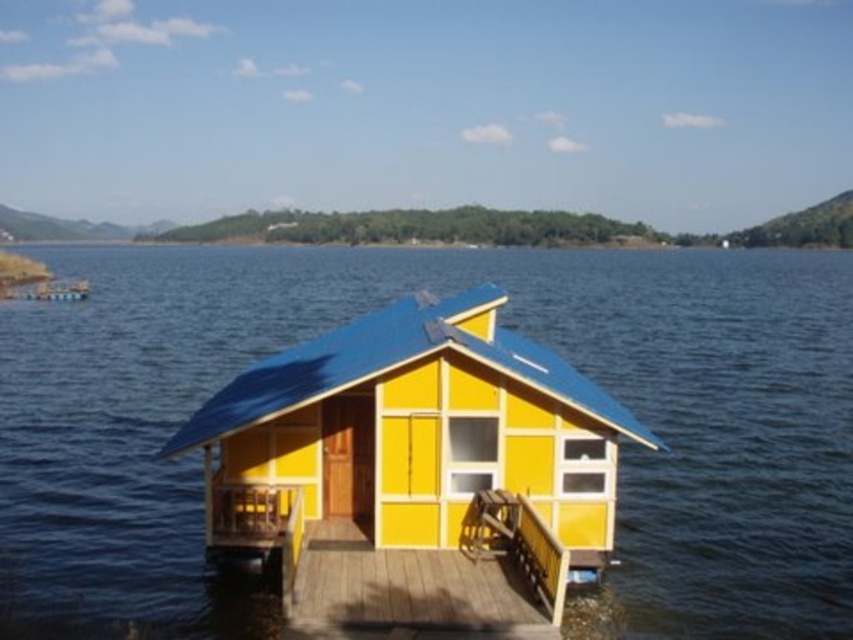
You are standing on the dock near the yellow painted wood hut at center. You want to throw a small ball to a friend who is standing 15 meters away from you in the direction of the hut. Will the ball reach your friend before hitting the water?

The yellow painted wood hut at center is 12.55 meters away from you. Since your friend is 15 meters away in the direction of the hut, the ball would need to travel 2.45 meters beyond the hut to reach them. However, the hut itself is an obstacle, so the ball would hit the hut before reaching your friend.